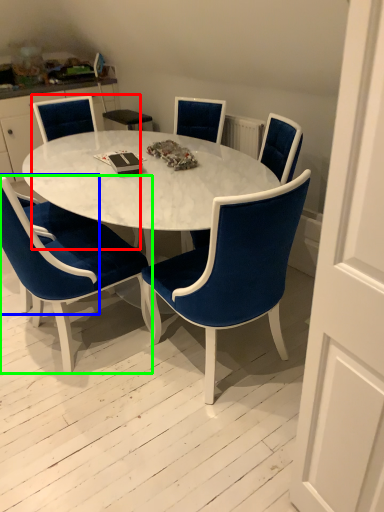
Question: Which object is the farthest from chair (highlighted by a red box)? Choose among these: armchair (highlighted by a blue box) or chair (highlighted by a green box).

Choices:
 (A) armchair
 (B) chair

Answer: (A)